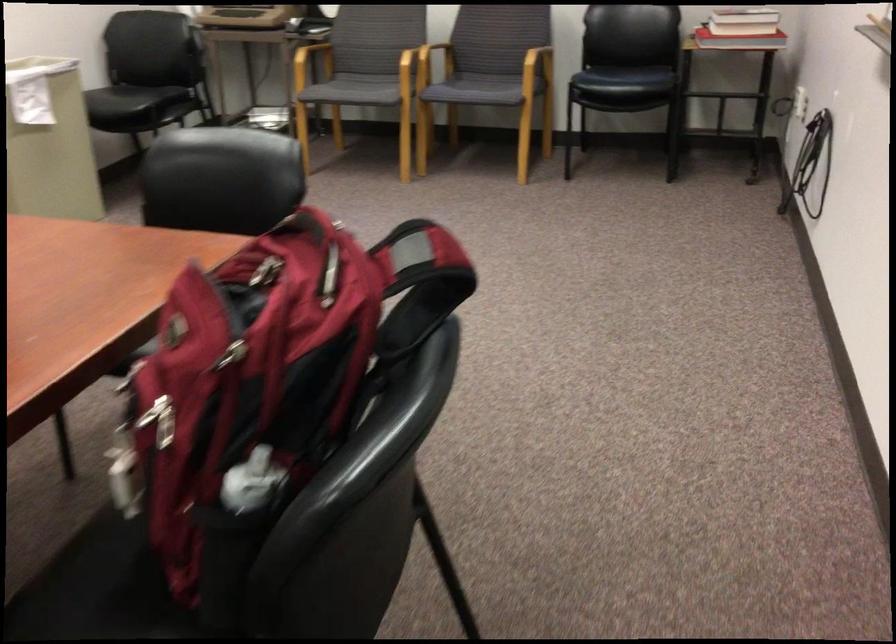
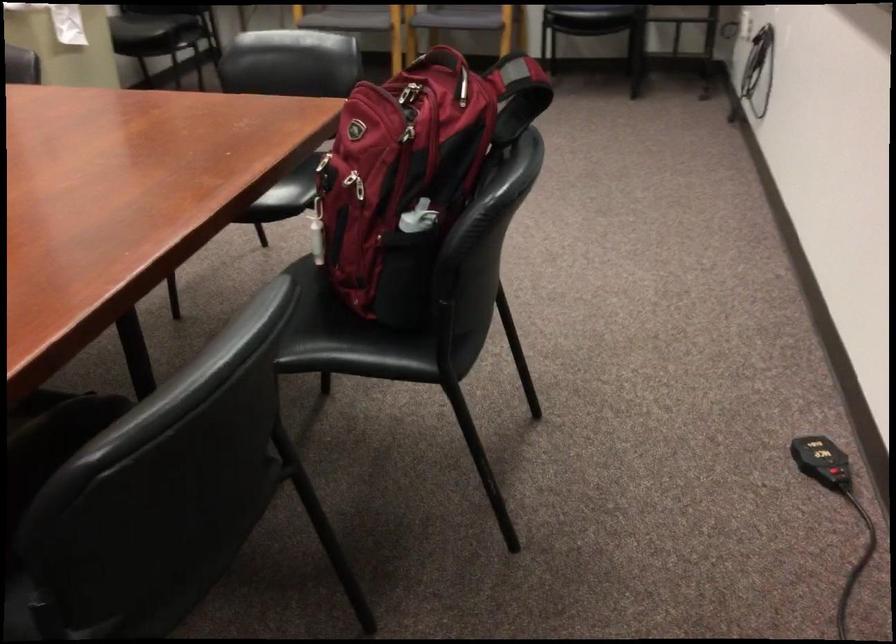
Locate, in the second image, the point that corresponds to pixel 251 355 in the first image.

(412, 136)